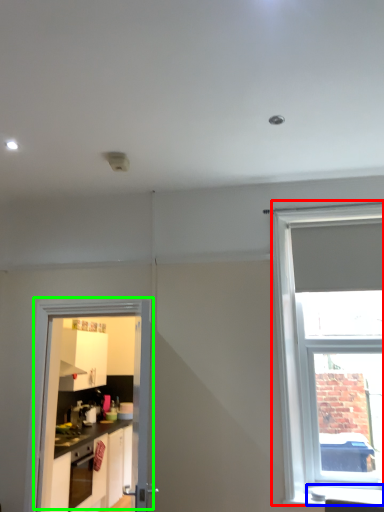
Question: Considering the real-world distances, which object is farthest from window (highlighted by a red box)? window sill (highlighted by a blue box) or door (highlighted by a green box)?

Choices:
 (A) window sill
 (B) door

Answer: (B)